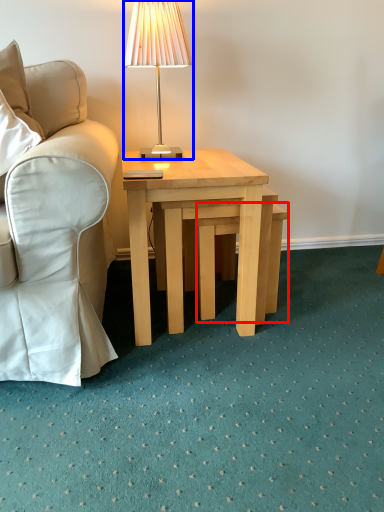
Question: Which point is further to the camera, stool (highlighted by a red box) or lamp (highlighted by a blue box)?

Choices:
 (A) stool
 (B) lamp

Answer: (A)